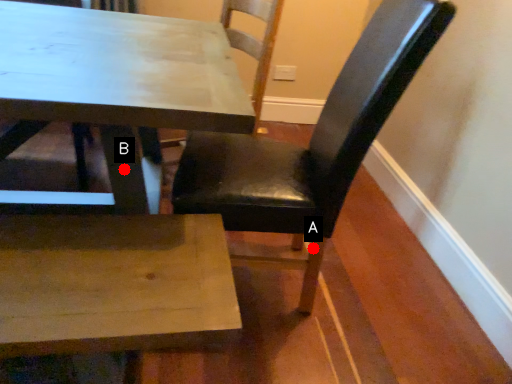
Question: Two points are circled on the image, labeled by A and B beside each circle. Which of the following is the farthest from the observer?

Choices:
 (A) A is further
 (B) B is further

Answer: (A)